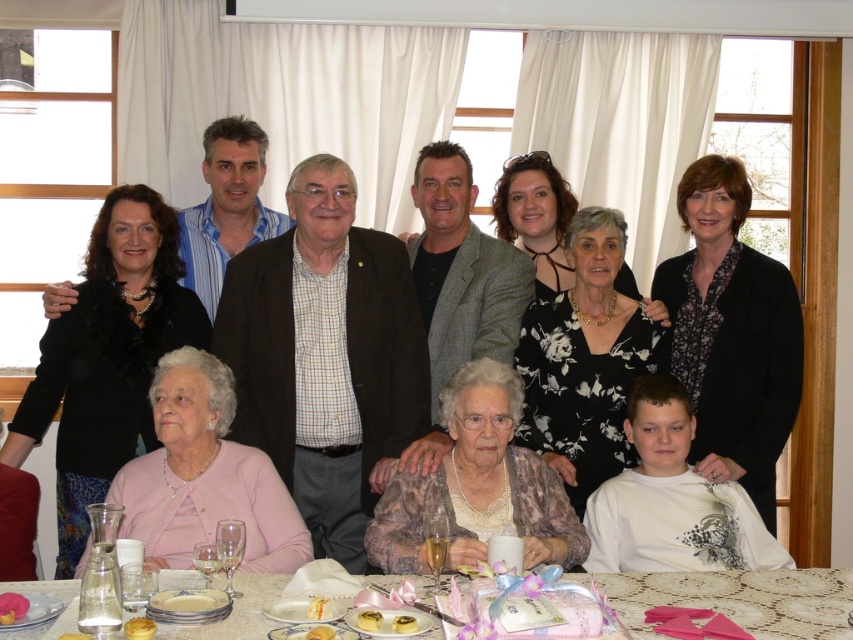
You are a guest at this gathering and want to grab the golden buttery croissant at lower center. Since you are standing behind the matte black jacket at center, can you reach it without moving around the jacket?

The golden buttery croissant at lower center is behind the matte black jacket at center, so you cannot reach it without moving around the jacket.

You are planning to serve both the golden cake at lower center and the smooth white cake at center to guests. Which cake has a larger volume?

The golden cake at lower center has a larger volume because it is much taller than the smooth white cake at center.